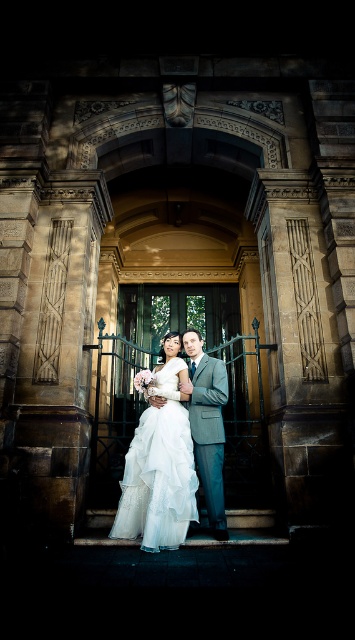
You are a photographer at the wedding. You want to ensure that both the white tulle dress at center and the light gray suit at center are clearly visible in the photo. Given their heights, which one might you need to adjust the camera angle for to capture both effectively?

The white tulle dress at center is not as tall as the light gray suit at center, so you might need to lower the camera angle slightly to ensure the shorter white tulle dress at center is fully visible while still capturing the taller light gray suit at center.